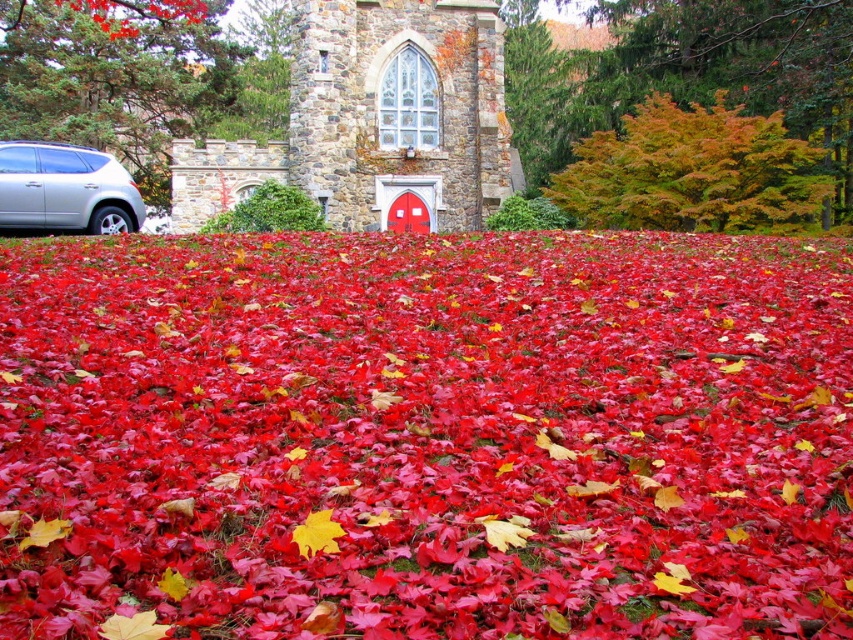
Question: Does orange-golden foliage at center come in front of yellow matte maple leaf at center?

Choices:
 (A) yes
 (B) no

Answer: (B)

Question: Is shiny red leaves at center positioned behind green leafy tree at left?

Choices:
 (A) yes
 (B) no

Answer: (B)

Question: Which point is farther to the camera?

Choices:
 (A) (529, 157)
 (B) (74, 196)
 (C) (289, 147)

Answer: (A)

Question: Which object is positioned farthest from the stone church at center?

Choices:
 (A) orange-golden foliage at center
 (B) shiny red leaves at center
 (C) green leafy tree at left

Answer: (B)

Question: Which point is closer to the camera?

Choices:
 (A) (325, 152)
 (B) (83, 10)
 (C) (51, 173)

Answer: (C)

Question: Is orange-golden foliage at center below yellow matte maple leaf at center?

Choices:
 (A) yes
 (B) no

Answer: (B)